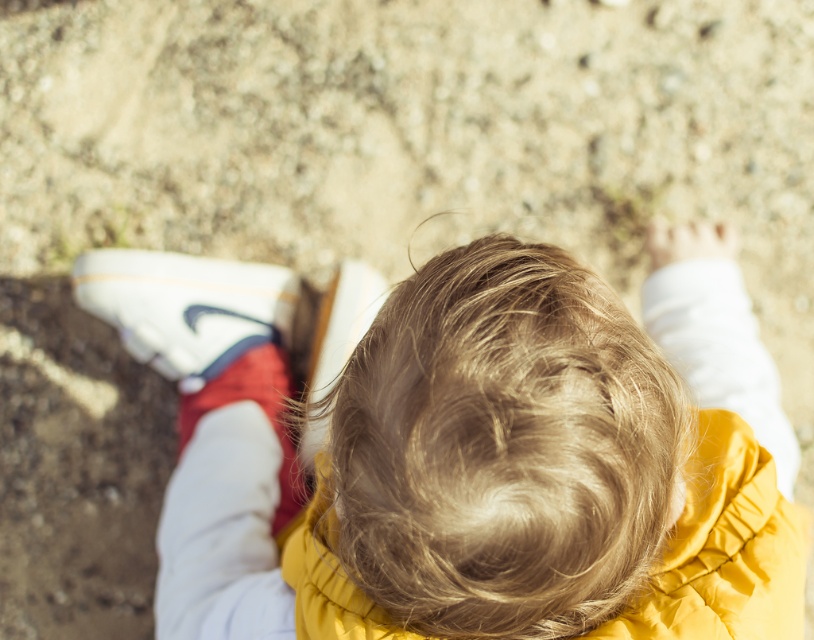
Question: Does smooth yellow jacket at center appear on the left side of white leather shoe at lower left?

Choices:
 (A) yes
 (B) no

Answer: (B)

Question: Is smooth yellow jacket at center in front of white leather shoe at lower left?

Choices:
 (A) no
 (B) yes

Answer: (B)

Question: Does smooth yellow jacket at center appear on the left side of white leather shoe at lower left?

Choices:
 (A) yes
 (B) no

Answer: (B)

Question: Which point is farther from the camera taking this photo?

Choices:
 (A) (499, 550)
 (B) (103, 273)

Answer: (B)

Question: Among these objects, which one is farthest from the camera?

Choices:
 (A) white leather shoe at lower left
 (B) smooth yellow jacket at center

Answer: (A)